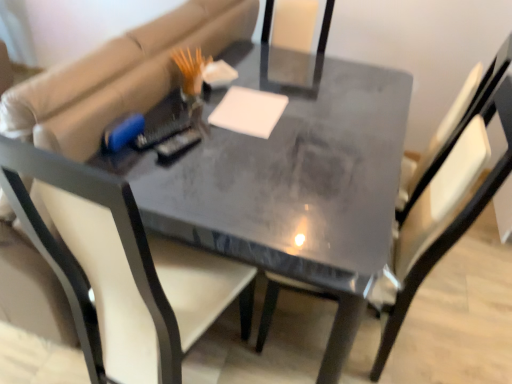
Locate an element on the screen. free region on the left part of white matte notepad at center is located at coordinates (192, 112).